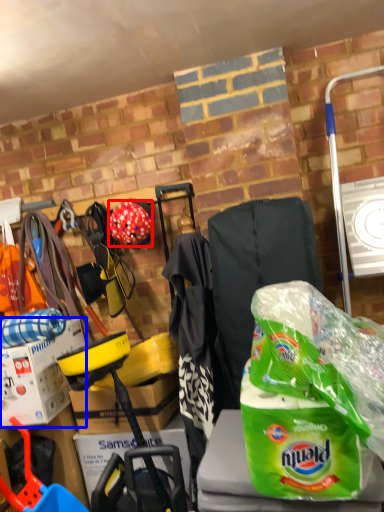
Question: Among these objects, which one is farthest to the camera, helmet (highlighted by a red box) or box (highlighted by a blue box)?

Choices:
 (A) helmet
 (B) box

Answer: (A)